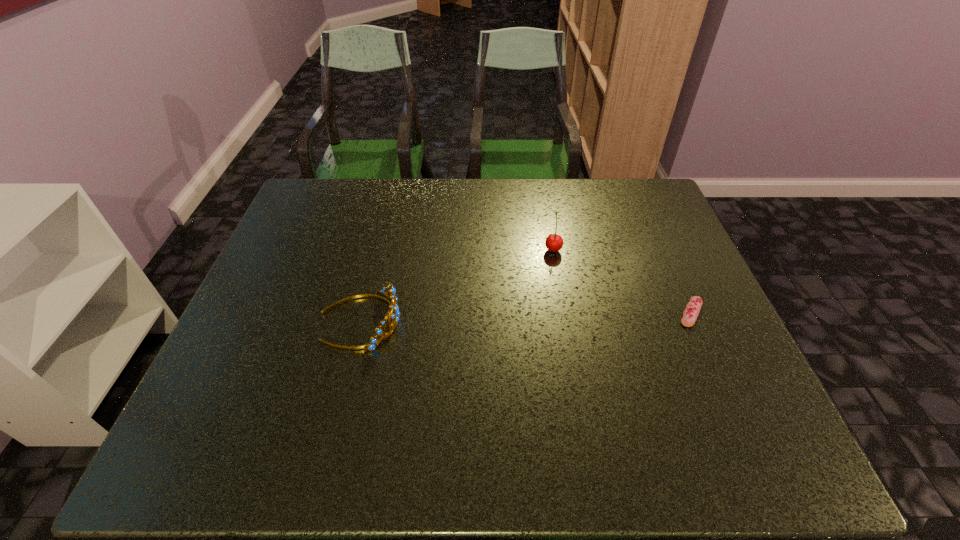
The image size is (960, 540). Find the location of `free space between the leftmost object and the eclair`. free space between the leftmost object and the eclair is located at coordinates (526, 316).

The height and width of the screenshot is (540, 960). Identify the location of empty space that is in between the farthest object and the rightmost object. (622, 281).

Locate an element on the screen. The width and height of the screenshot is (960, 540). vacant area that lies between the leftmost object and the cherry is located at coordinates (457, 285).

What are the coordinates of `empty space that is in between the leftmost object and the rightmost object` in the screenshot? It's located at (526, 316).

This screenshot has height=540, width=960. I want to click on free space between the farthest object and the leftmost object, so click(x=457, y=285).

Locate which object is the closest to the cherry. Please provide its 2D coordinates. Your answer should be formatted as a tuple, i.e. [(x, y)], where the tuple contains the x and y coordinates of a point satisfying the conditions above.

[(690, 314)]

The width and height of the screenshot is (960, 540). I want to click on the closest object to the leftmost object, so click(x=554, y=242).

Where is `free spot that satisfies the following two spatial constraints: 1. on the front side of the farthest object; 2. on the front-facing side of the tiara`? Image resolution: width=960 pixels, height=540 pixels. free spot that satisfies the following two spatial constraints: 1. on the front side of the farthest object; 2. on the front-facing side of the tiara is located at coordinates (565, 320).

Where is `vacant space that satisfies the following two spatial constraints: 1. on the front side of the cherry; 2. on the front-facing side of the tiara`? vacant space that satisfies the following two spatial constraints: 1. on the front side of the cherry; 2. on the front-facing side of the tiara is located at coordinates pos(565,320).

Find the location of a particular element. vacant space that satisfies the following two spatial constraints: 1. on the front side of the eclair; 2. on the front-facing side of the tiara is located at coordinates coord(694,320).